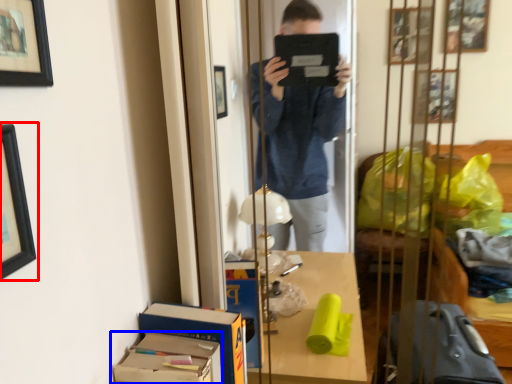
Question: Which object is further to the camera taking this photo, picture frame (highlighted by a red box) or cardboard box (highlighted by a blue box)?

Choices:
 (A) picture frame
 (B) cardboard box

Answer: (B)